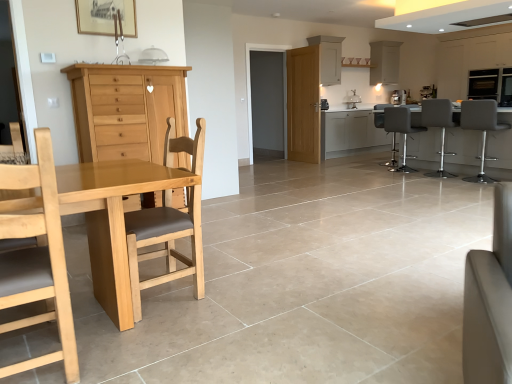
Question: Is there a large distance between wooden picture frame at upper center and white glossy cabinet at upper center, which is counted as the fourth cabinetry, starting from the left?

Choices:
 (A) yes
 (B) no

Answer: (A)

Question: Is wooden picture frame at upper center looking in the opposite direction of white glossy cabinet at upper center, the fifth cabinetry when ordered from front to back?

Choices:
 (A) no
 (B) yes

Answer: (A)

Question: Does wooden picture frame at upper center have a larger size compared to white glossy cabinet at upper center, which is counted as the fourth cabinetry, starting from the left?

Choices:
 (A) no
 (B) yes

Answer: (A)

Question: Is white glossy cabinet at upper center, which is counted as the second cabinetry, starting from the right, inside wooden picture frame at upper center?

Choices:
 (A) yes
 (B) no

Answer: (B)

Question: Considering the relative sizes of wooden picture frame at upper center and white glossy cabinet at upper center, which ranks as the 1th cabinetry in back-to-front order, in the image provided, is wooden picture frame at upper center shorter than white glossy cabinet at upper center, which ranks as the 1th cabinetry in back-to-front order,?

Choices:
 (A) yes
 (B) no

Answer: (A)

Question: From the image's perspective, is matte white cabinet at upper right, which is the second cabinetry in front-to-back order, positioned above or below light brown wood cabinet at left, which appears as the fifth cabinetry when viewed from the back?

Choices:
 (A) below
 (B) above

Answer: (B)

Question: Is point (439, 56) closer or farther from the camera than point (74, 77)?

Choices:
 (A) closer
 (B) farther

Answer: (B)

Question: Is matte white cabinet at upper right, the fourth cabinetry from the back, spatially inside light brown wood cabinet at left, the first cabinetry from the front, or outside of it?

Choices:
 (A) inside
 (B) outside

Answer: (B)

Question: In terms of size, does matte white cabinet at upper right, the fourth cabinetry from the back, appear bigger or smaller than light brown wood cabinet at left, arranged as the 1th cabinetry when viewed from the left?

Choices:
 (A) small
 (B) big

Answer: (B)

Question: From the image's perspective, is white matte cabinet at upper center, the third cabinetry viewed from the front, located above or below white glossy cabinet at upper center, which is counted as the fourth cabinetry, starting from the left?

Choices:
 (A) above
 (B) below

Answer: (B)

Question: Would you say white matte cabinet at upper center, arranged as the second cabinetry when viewed from the left, is inside or outside white glossy cabinet at upper center, the fifth cabinetry when ordered from front to back?

Choices:
 (A) inside
 (B) outside

Answer: (B)

Question: Considering the positions of white matte cabinet at upper center, the third cabinetry viewed from the front, and white glossy cabinet at upper center, the fifth cabinetry when ordered from front to back, in the image, is white matte cabinet at upper center, the third cabinetry viewed from the front, taller or shorter than white glossy cabinet at upper center, the fifth cabinetry when ordered from front to back,?

Choices:
 (A) tall
 (B) short

Answer: (A)

Question: Visually, is white matte cabinet at upper center, arranged as the second cabinetry when viewed from the left, positioned to the left or to the right of white glossy cabinet at upper center, which ranks as the 1th cabinetry in back-to-front order?

Choices:
 (A) right
 (B) left

Answer: (B)

Question: Based on their sizes in the image, would you say matte white cabinet at upper right, acting as the first cabinetry starting from the right, is bigger or smaller than white leather couch at lower right?

Choices:
 (A) big
 (B) small

Answer: (A)

Question: Is matte white cabinet at upper right, which is the second cabinetry in front-to-back order, inside the boundaries of white leather couch at lower right, or outside?

Choices:
 (A) outside
 (B) inside

Answer: (A)